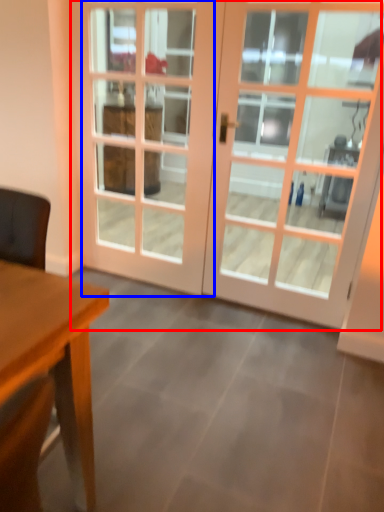
Question: Which of the following is the closest to the observer, door (highlighted by a red box) or screen door (highlighted by a blue box)?

Choices:
 (A) door
 (B) screen door

Answer: (A)